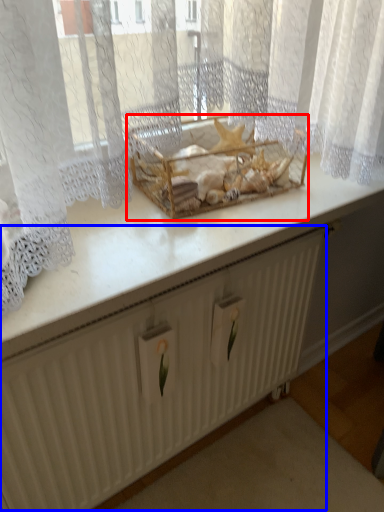
Question: Which of the following is the closest to the observer, crate (highlighted by a red box) or radiator (highlighted by a blue box)?

Choices:
 (A) crate
 (B) radiator

Answer: (B)